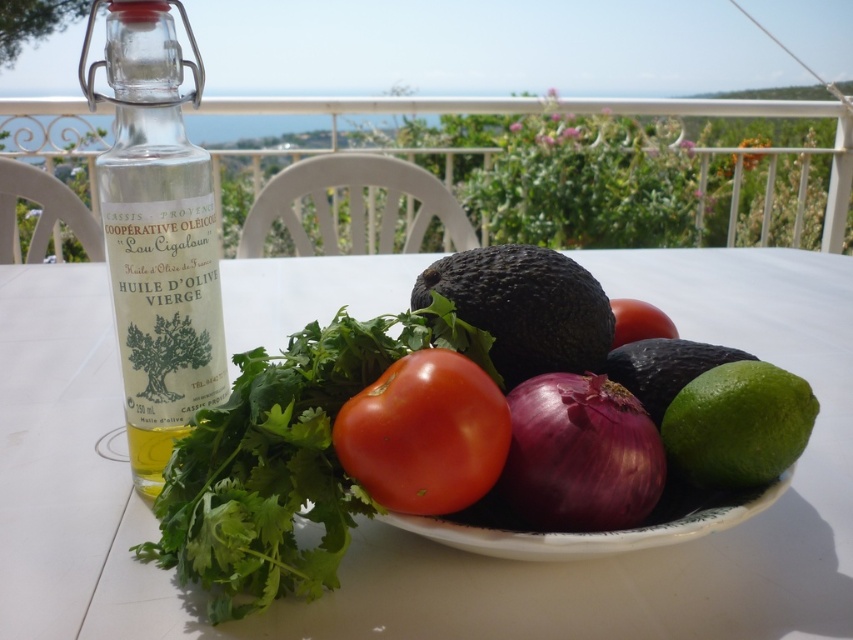
You are setting up a picnic and need to place a small basket on the table. Given the white glossy table at center and the shiny red tomato at center, which object can accommodate the basket in terms of size?

The white glossy table at center has a larger size compared to the shiny red tomato at center, so the basket can be placed on the white glossy table at center.

You are a chef preparing a dish and need to place a cutting board between the white glossy table at center and the black matte avocado at center. Can the cutting board be placed there without touching either object?

The white glossy table at center is taller than the black matte avocado at center. Since the table is taller, there is vertical space between them where the cutting board can be placed without touching either object.

You are setting up a picnic and need to place a basket on the table. Given the coordinates of the white glossy table at center, where should you position the basket to ensure it doesn

The white glossy table at center is located at point (416, 536), so placing the basket there would be appropriate.